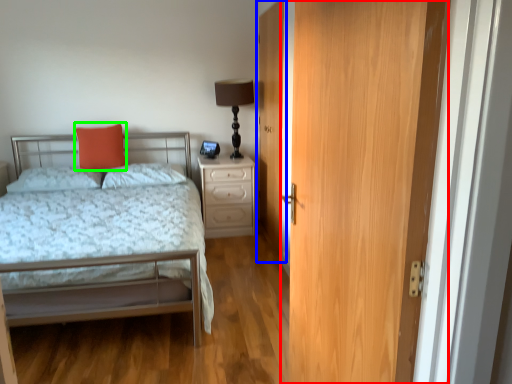
Question: Which object is positioned closest to door (highlighted by a red box)? Select from door (highlighted by a blue box) and throw pillow (highlighted by a green box).

Choices:
 (A) door
 (B) throw pillow

Answer: (A)